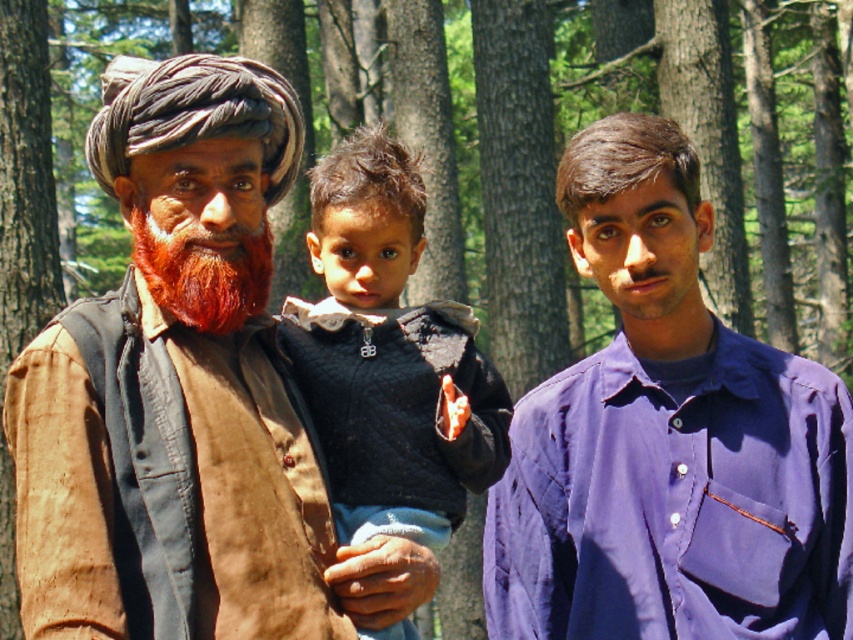
Who is more forward, [549,435] or [402,438]?

Point [402,438] is more forward.

Is purple cotton shirt at center to the right of dark blue sweater at center from the viewer's perspective?

Indeed, purple cotton shirt at center is positioned on the right side of dark blue sweater at center.

From the picture: Who is more distant from viewer, [845,540] or [357,320]?

Result: The point [845,540] is more distant.

Locate an element on the screen. This screenshot has height=640, width=853. purple cotton shirt at center is located at coordinates (666, 440).

Is point (370, 512) behind point (154, 243)?

That is True.

Between point (345, 220) and point (170, 282), which one is positioned in front?

Point (170, 282) is in front.

Find the location of a particular element. This screenshot has height=640, width=853. dark blue sweater at center is located at coordinates (389, 356).

Is purple cotton shirt at center further to the viewer compared to reddish-brown textured beard at center?

That is True.

Is purple cotton shirt at center above reddish-brown textured beard at center?

No, purple cotton shirt at center is not above reddish-brown textured beard at center.

Which is behind, point (625, 400) or point (177, 292)?

The point (625, 400) is behind.

In order to click on purple cotton shirt at center in this screenshot , I will do `click(666, 440)`.